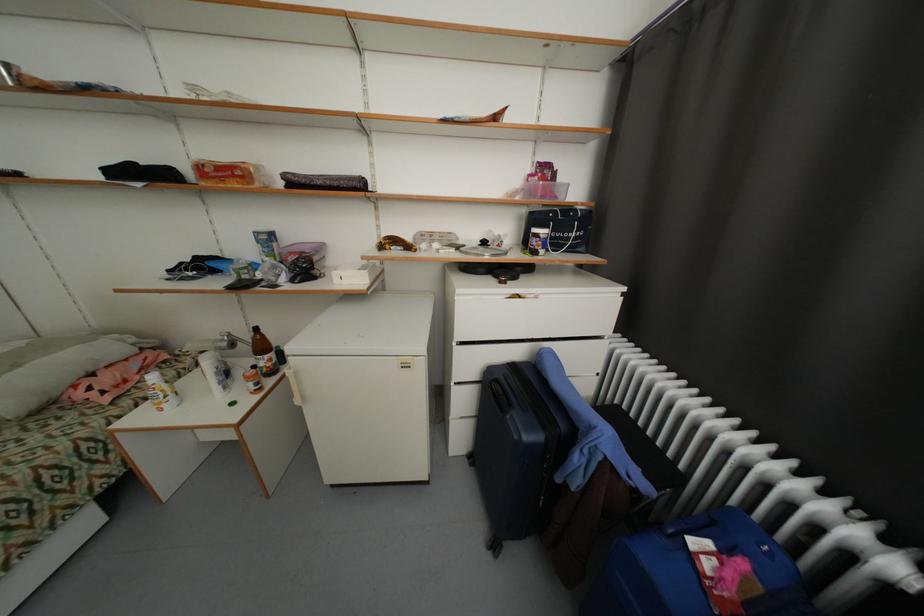
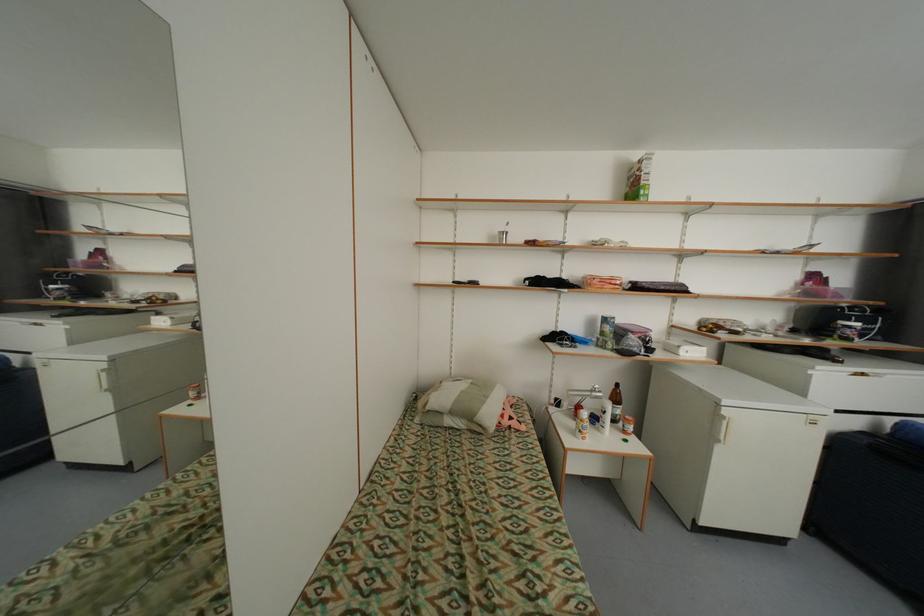
Which direction would the cameraman need to move to produce the second image?

The cameraman moved toward left, backward.